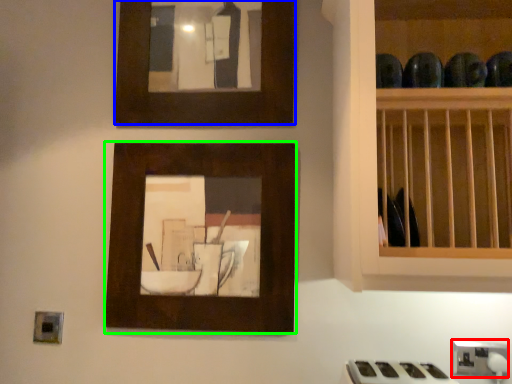
Question: Considering the real-world distances, which object is closest to electric outlet (highlighted by a red box)? picture frame (highlighted by a blue box) or picture frame (highlighted by a green box).

Choices:
 (A) picture frame
 (B) picture frame

Answer: (B)